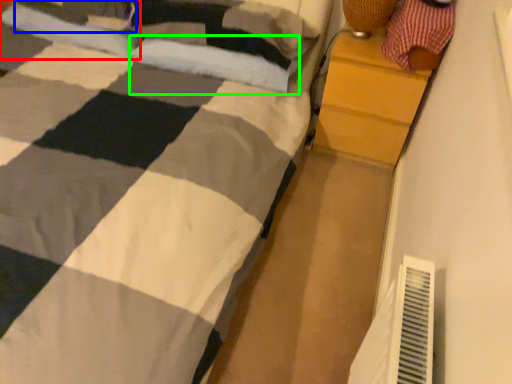
Question: Considering the real-world distances, which object is farthest from pillow (highlighted by a red box)? pillow (highlighted by a blue box) or pillow (highlighted by a green box)?

Choices:
 (A) pillow
 (B) pillow

Answer: (B)